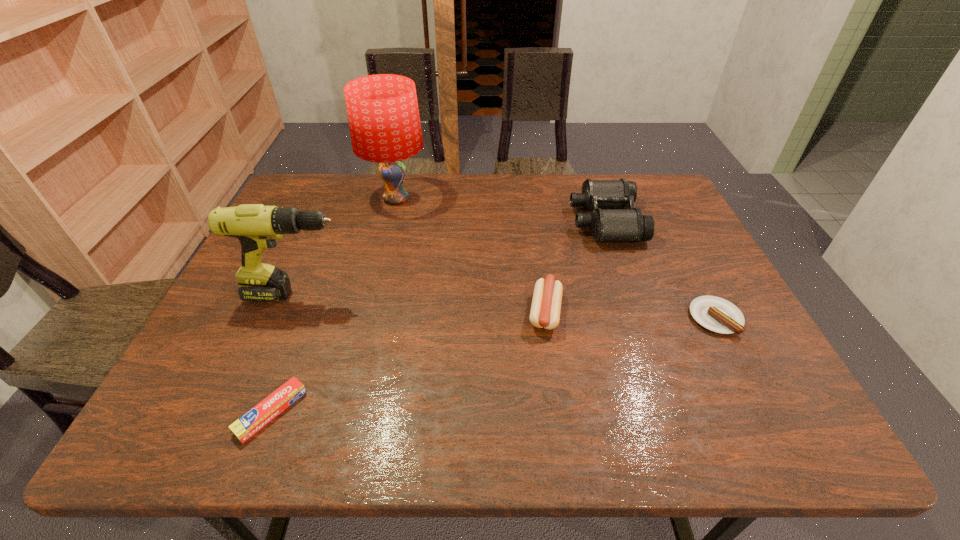
Identify the location of the tallest object. This screenshot has height=540, width=960. (383, 114).

The image size is (960, 540). Identify the location of drill. (256, 226).

Find the location of a particular element. The width and height of the screenshot is (960, 540). binoculars is located at coordinates (609, 221).

This screenshot has height=540, width=960. I want to click on the third tallest object, so click(x=609, y=221).

I want to click on the taller sausage, so click(x=546, y=304).

Where is `the third shortest object`? The height and width of the screenshot is (540, 960). the third shortest object is located at coordinates (546, 304).

Find the location of `the right sausage`. the right sausage is located at coordinates (716, 314).

I want to click on the fifth tallest object, so click(x=716, y=314).

Locate an element on the screen. The image size is (960, 540). the shortest object is located at coordinates (246, 426).

This screenshot has height=540, width=960. What are the coordinates of `the nearest object` in the screenshot? It's located at (246, 426).